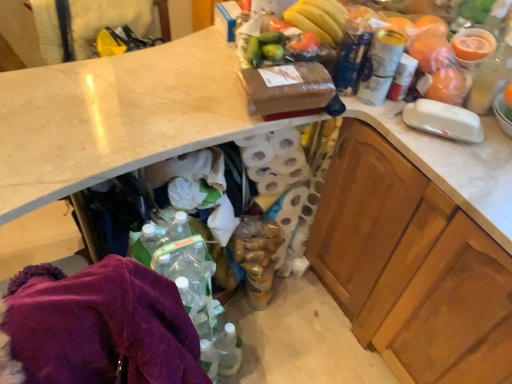
Where is `vacant space in front of metallic silver can at upper right, arranged as the second bottle when viewed from the right`? vacant space in front of metallic silver can at upper right, arranged as the second bottle when viewed from the right is located at coordinates (401, 131).